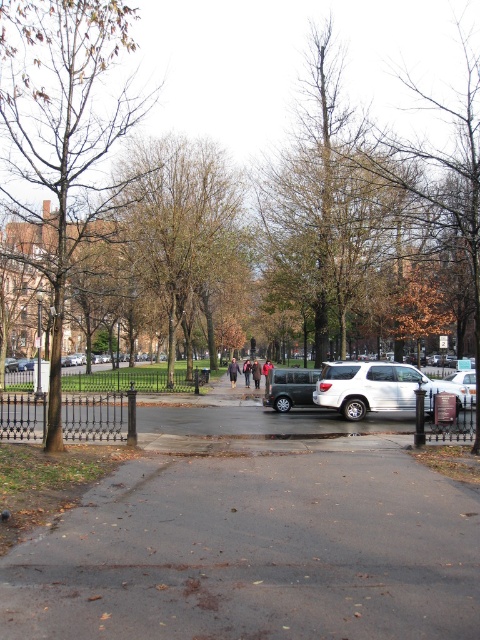
Consider the image. You are a delivery driver who needs to park your matte black van at center in a parking lot located at coordinates 0.606, 0.604. Is the parking lot at that coordinate large enough to accommodate your vehicle?

The position of matte black van at center is at point (289,387), so the parking lot at that coordinate is exactly where the matte black van at center is located, meaning it should be large enough to accommodate the vehicle.

You are standing at the park entrance and see the dark asphalt pavement at center and the dark brown leather jacket at center. Which object is located to the right?

The dark brown leather jacket at center is located to the right of the dark asphalt pavement at center.

You are standing at the entrance of the park and want to reach the dark asphalt pavement at center. According to the coordinates provided, in which direction should you walk from your current position?

The dark asphalt pavement at center is located at coordinates point (254,538), so you should walk forward towards the center of the park to reach it.